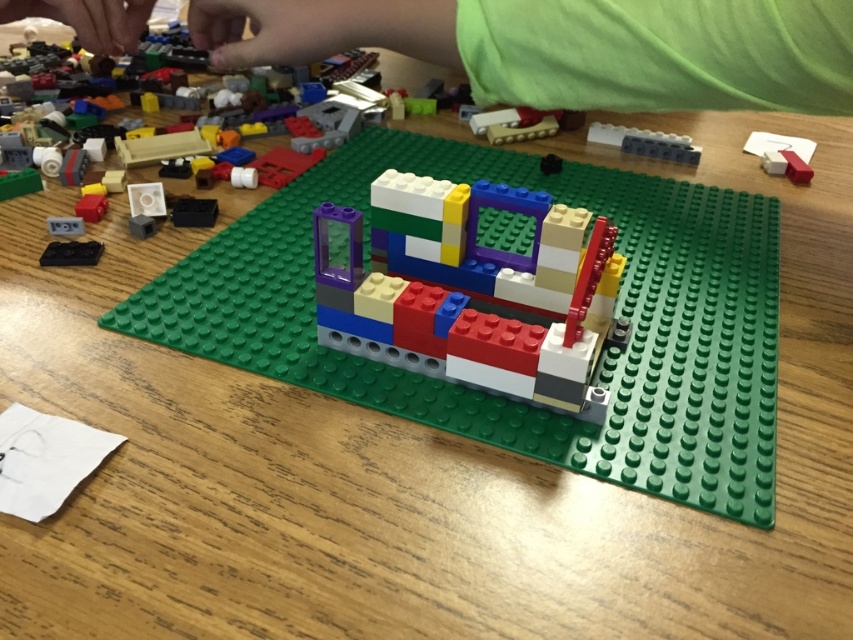
What is the color of the LEGO brick located at the coordinates point (645,141)?

The gray matte brick at upper right is located at point (645,141).

You are a LEGO builder trying to reach the multicolored plastic bricks at center to continue building. The green fabric arm at upper center is in your way. Can you move the arm to access the bricks?

The green fabric arm at upper center is further to the viewer than the multicolored plastic bricks at center, so moving the arm would allow you to access the bricks since it is closer to you.